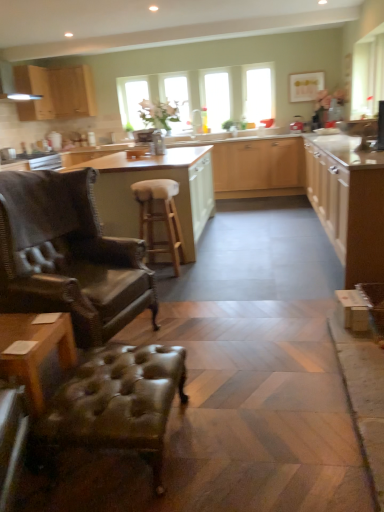
Where is `free point above leather tufted ottoman at lower left (from a real-world perspective)`? This screenshot has height=512, width=384. free point above leather tufted ottoman at lower left (from a real-world perspective) is located at coordinates (132, 371).